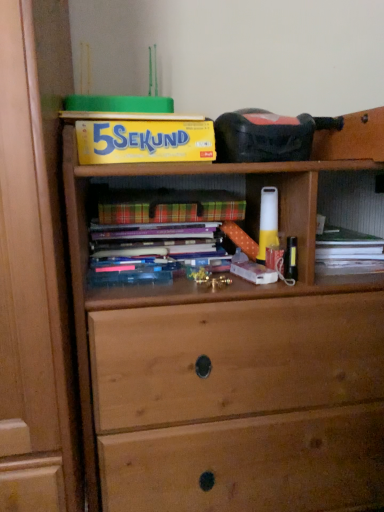
Question: In which direction should I rotate to look at plaid paper at center, arranged as the 1th paperback book when ordered from the bottom?

Choices:
 (A) left
 (B) right

Answer: (A)

Question: Is hardcover book at center smaller than plaid paper at center, arranged as the second paperback book when viewed from the top?

Choices:
 (A) no
 (B) yes

Answer: (B)

Question: From a real-world perspective, is hardcover book at center beneath plaid paper at center, arranged as the 1th paperback book when ordered from the bottom?

Choices:
 (A) no
 (B) yes

Answer: (B)

Question: Does hardcover book at center have a lesser width compared to plaid paper at center, arranged as the second paperback book when viewed from the top?

Choices:
 (A) no
 (B) yes

Answer: (B)

Question: Is plaid paper at center, arranged as the second paperback book when viewed from the top, at the back of hardcover book at center?

Choices:
 (A) yes
 (B) no

Answer: (B)

Question: Is hardcover book at center taller than plaid paper at center, arranged as the 1th paperback book when ordered from the bottom?

Choices:
 (A) no
 (B) yes

Answer: (A)

Question: Is hardcover book at center shorter than plaid paper at center, arranged as the 1th paperback book when ordered from the bottom?

Choices:
 (A) no
 (B) yes

Answer: (B)

Question: Considering the relative sizes of plaid paper at center, arranged as the second paperback book when viewed from the top, and yellow cardboard box at upper center, which appears as the 1th paperback book when viewed from the top, in the image provided, is plaid paper at center, arranged as the second paperback book when viewed from the top, shorter than yellow cardboard box at upper center, which appears as the 1th paperback book when viewed from the top,?

Choices:
 (A) yes
 (B) no

Answer: (A)

Question: Is plaid paper at center, arranged as the second paperback book when viewed from the top, to the left of yellow cardboard box at upper center, acting as the 2th paperback book starting from the bottom, from the viewer's perspective?

Choices:
 (A) no
 (B) yes

Answer: (A)

Question: Is yellow cardboard box at upper center, acting as the 2th paperback book starting from the bottom, inside plaid paper at center, arranged as the second paperback book when viewed from the top?

Choices:
 (A) no
 (B) yes

Answer: (A)

Question: From a real-world perspective, is plaid paper at center, arranged as the second paperback book when viewed from the top, over yellow cardboard box at upper center, acting as the 2th paperback book starting from the bottom?

Choices:
 (A) no
 (B) yes

Answer: (A)

Question: Is there a large distance between plaid paper at center, arranged as the 1th paperback book when ordered from the bottom, and yellow cardboard box at upper center, which appears as the 1th paperback book when viewed from the top?

Choices:
 (A) no
 (B) yes

Answer: (A)

Question: Does plaid paper at center, arranged as the 1th paperback book when ordered from the bottom, come in front of yellow cardboard box at upper center, acting as the 2th paperback book starting from the bottom?

Choices:
 (A) yes
 (B) no

Answer: (B)

Question: Does yellow cardboard box at upper center, which appears as the 1th paperback book when viewed from the top, have a greater height compared to plaid paper at center, arranged as the second paperback book when viewed from the top?

Choices:
 (A) yes
 (B) no

Answer: (A)